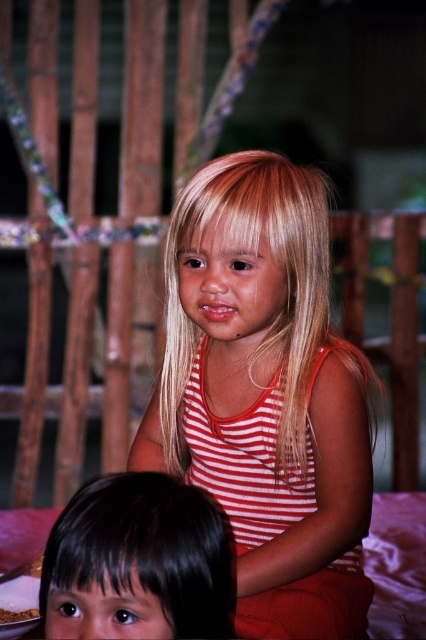
Is point (255, 499) positioned after point (155, 540)?

Yes, point (255, 499) is behind point (155, 540).

Does striped fabric tank top at center appear on the left side of black hair at lower left?

In fact, striped fabric tank top at center is to the right of black hair at lower left.

Is point (230, 364) farther from camera compared to point (149, 536)?

Yes, it is behind point (149, 536).

The height and width of the screenshot is (640, 426). In order to click on striped fabric tank top at center in this screenshot , I will do `click(265, 394)`.